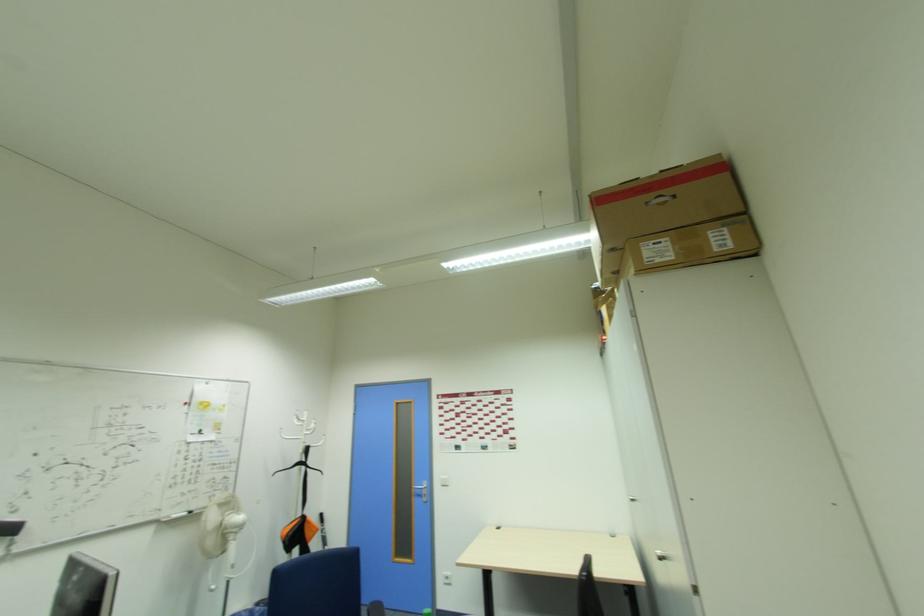
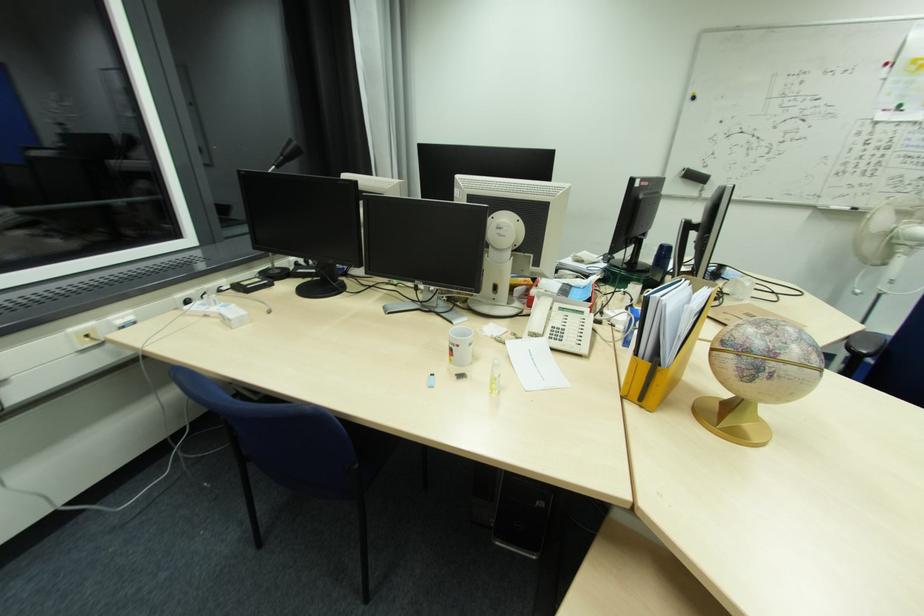
The first image is from the beginning of the video and the second image is from the end. How did the camera likely rotate when shooting the video?

The camera's rotation is toward left-down.